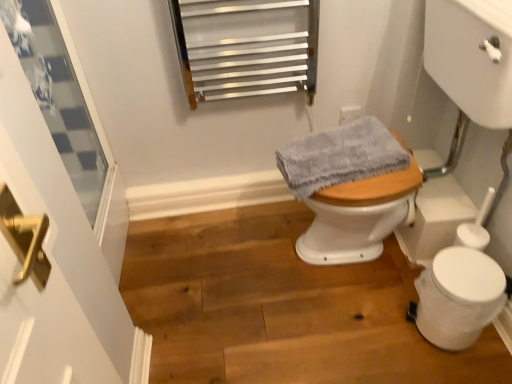
Question: From a real-world perspective, is clear glass window at upper left positioned above or below white plastic toilet bowl at lower right?

Choices:
 (A) below
 (B) above

Answer: (B)

Question: Considering the positions of clear glass window at upper left and white plastic toilet bowl at lower right in the image, is clear glass window at upper left taller or shorter than white plastic toilet bowl at lower right?

Choices:
 (A) short
 (B) tall

Answer: (B)

Question: Estimate the real-world distances between objects in this image. Which object is farther from the clear glass window at upper left?

Choices:
 (A) white glossy sink at right
 (B) gray fabric at center
 (C) wooden floor at center
 (D) white plastic toilet bowl at lower right

Answer: (D)

Question: Which object is positioned closest to the white plastic toilet bowl at lower right?

Choices:
 (A) clear glass window at upper left
 (B) gray fabric at center
 (C) white glossy sink at right
 (D) wooden floor at center

Answer: (C)